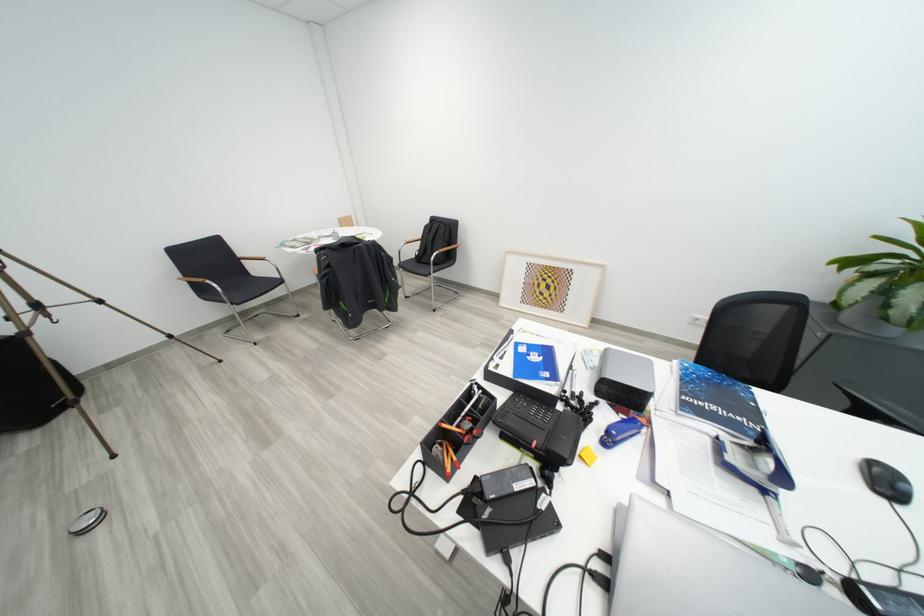
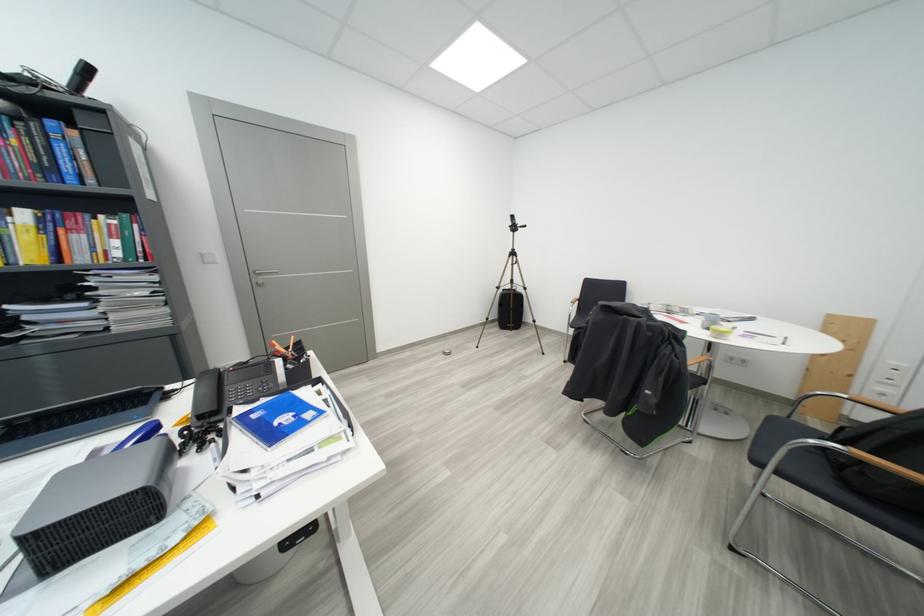
Question: I am providing you with two images of the same scene from different viewpoints. After the viewpoint changes to image2, which objects are now occluded?

Choices:
 (A) clear storage bin
 (B) red handled pliers
 (C) chair sitting surface
 (D) blue hardcover book

Answer: (B)